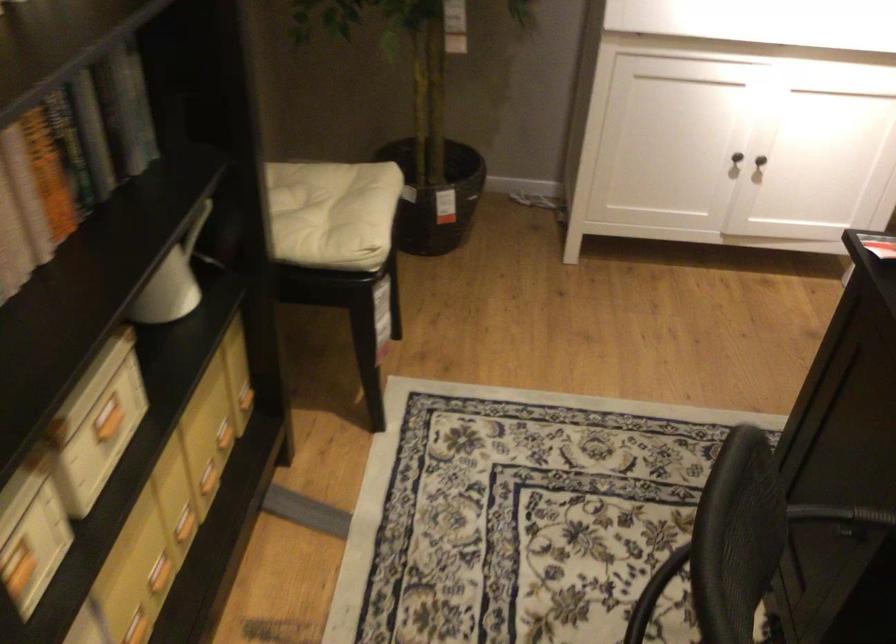
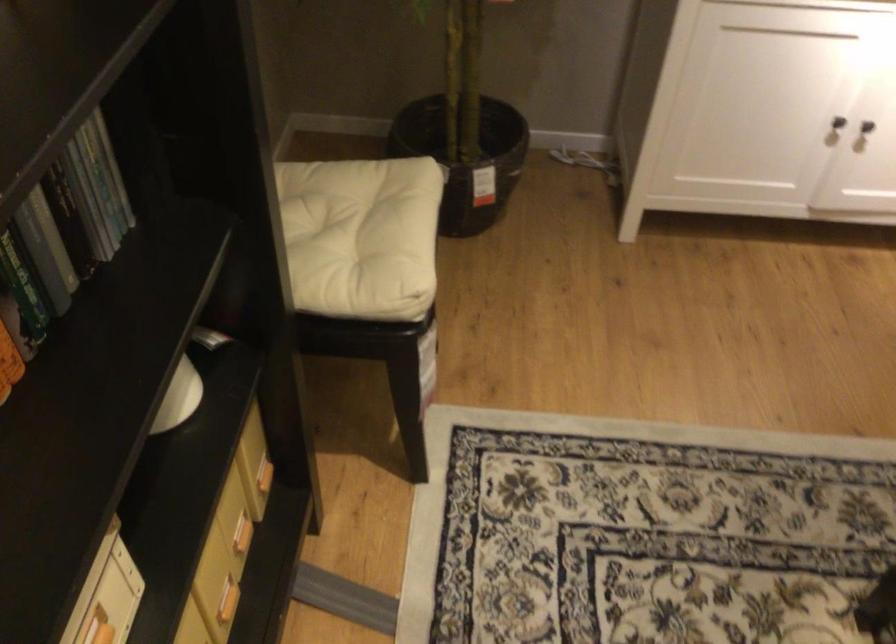
Locate, in the second image, the point that corresponds to [762,162] in the first image.

(866, 126)